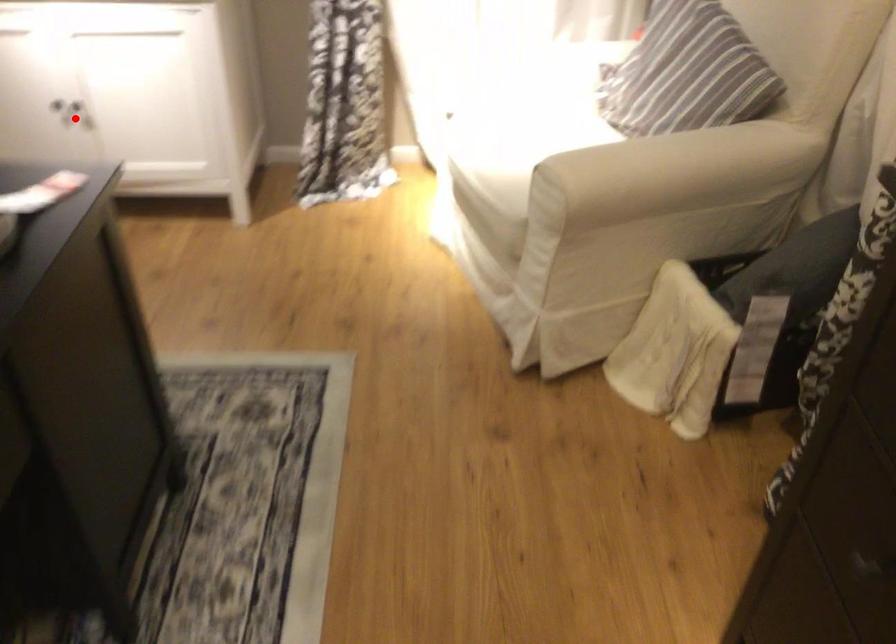
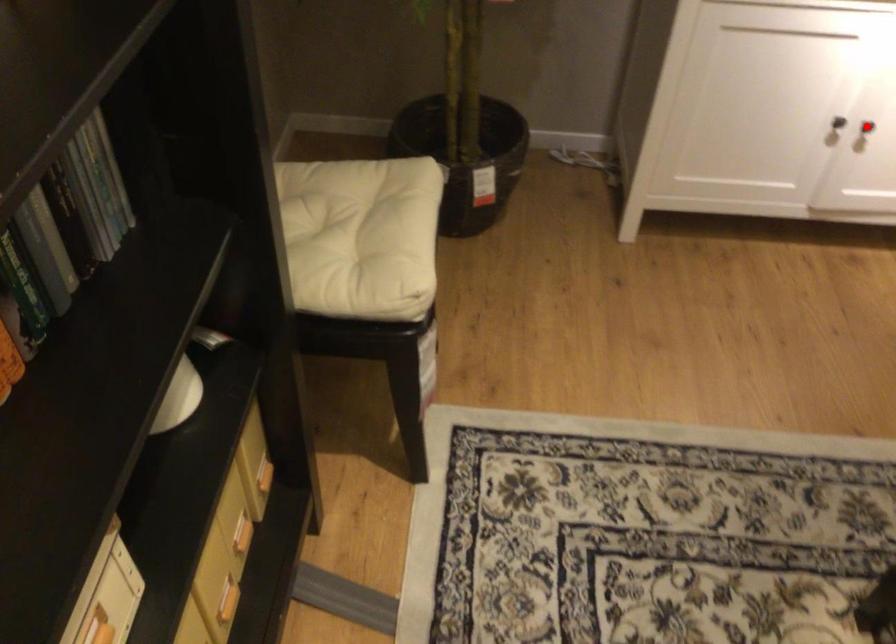
I am providing you with two images of the same scene from different viewpoints. A red point is marked on the first image and another point is marked on the second image. Does the point marked in image1 correspond to the same location as the one in image2?

Yes